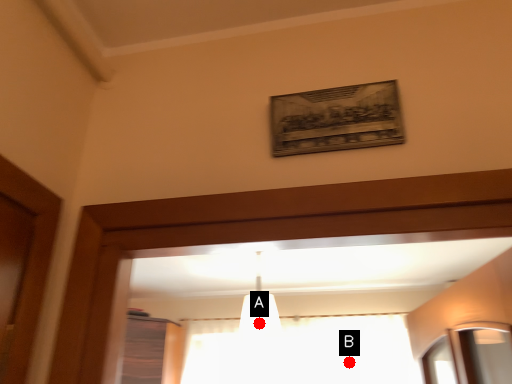
Question: Two points are circled on the image, labeled by A and B beside each circle. Which point is closer to the camera?

Choices:
 (A) A is closer
 (B) B is closer

Answer: (A)